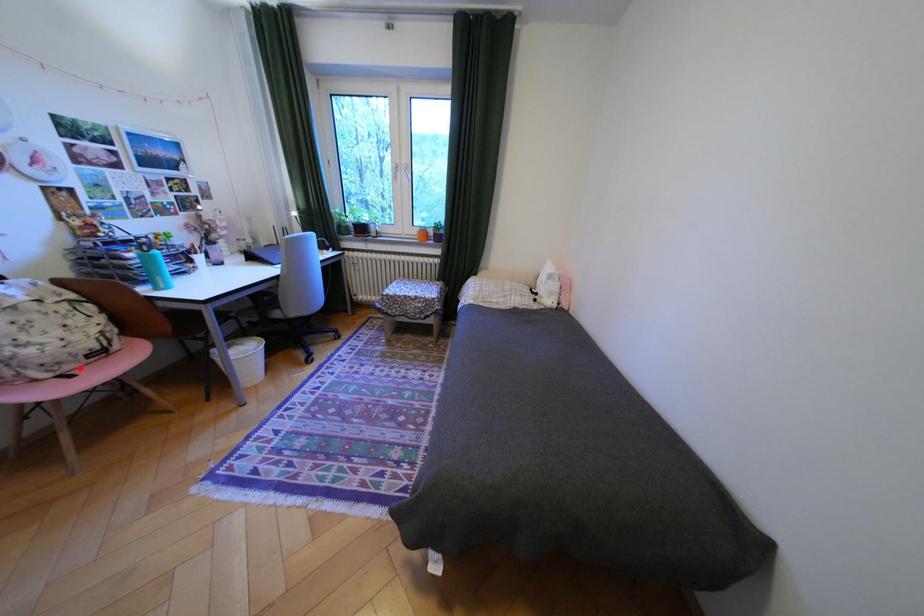
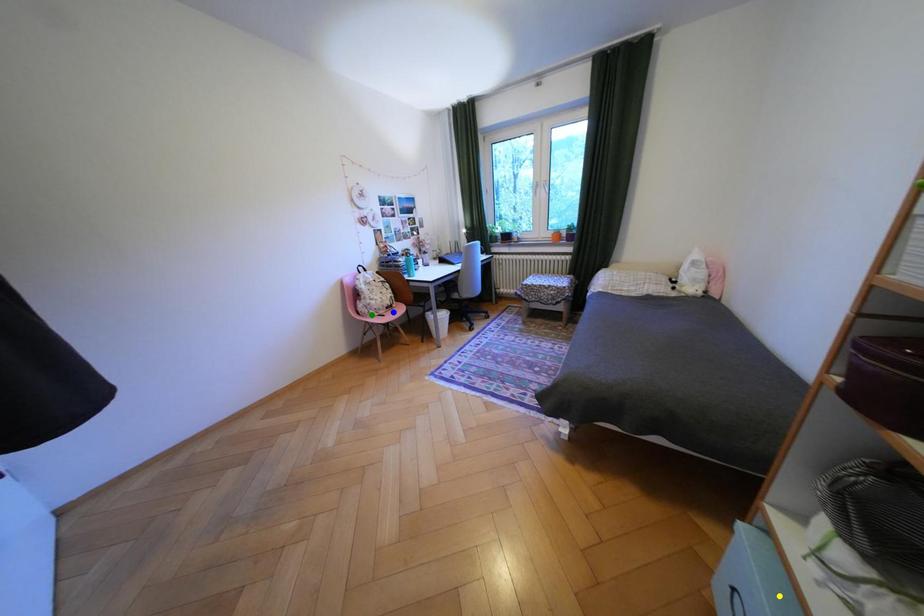
Question: I am providing you with two images of the same scene from different viewpoints. A red point is marked on the first image. You are given multiple points on the second image. In image 2, which mark is for the same physical point as the one in image 1?

Choices:
 (A) green point
 (B) blue point
 (C) yellow point

Answer: (B)